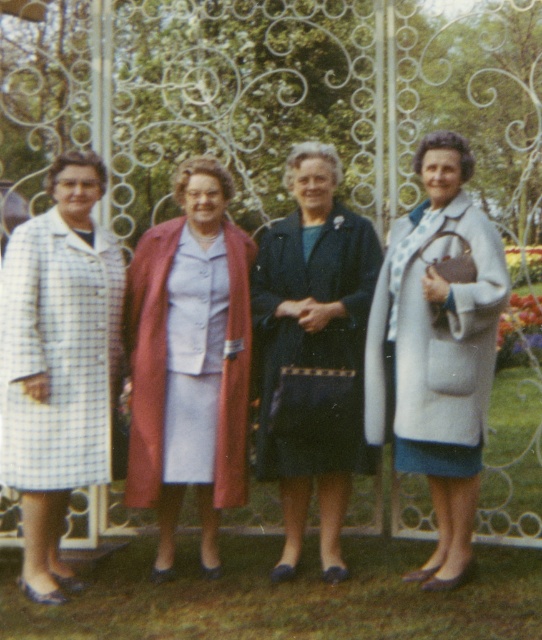
Who is more forward, (170, 275) or (41, 417)?

Point (41, 417) is more forward.

You are a GUI agent. You are given a task and a screenshot of the screen. Output one action in this format:
    pyautogui.click(x=<x>, y=<y>)
    Task: Click on the matte pink coat at center
    The image size is (542, 640).
    Given the screenshot: What is the action you would take?
    pos(190,360)

Between checkered fabric coat at left and light gray wool coat at right, which one is positioned lower?

checkered fabric coat at left is lower down.

Can you confirm if checkered fabric coat at left is positioned below light gray wool coat at right?

Indeed, checkered fabric coat at left is positioned under light gray wool coat at right.

Identify the location of checkered fabric coat at left. (57, 362).

At what (x,y) coordinates should I click in order to perform the action: click on checkered fabric coat at left. Please return your answer as a coordinate pair (x, y). The image size is (542, 640). Looking at the image, I should click on (57, 362).

Does matte pink coat at center have a greater width compared to dark blue fabric coat at center?

No.

Which is more to the right, matte pink coat at center or dark blue fabric coat at center?

Positioned to the right is dark blue fabric coat at center.

The width and height of the screenshot is (542, 640). Describe the element at coordinates (190, 360) in the screenshot. I see `matte pink coat at center` at that location.

The width and height of the screenshot is (542, 640). In order to click on matte pink coat at center in this screenshot , I will do `click(190, 360)`.